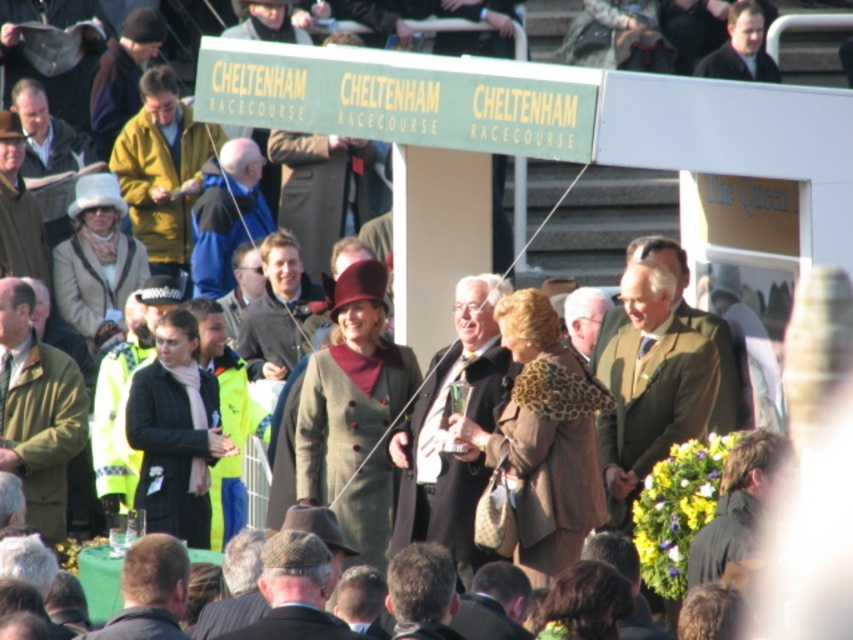
Who is more forward, (688, 429) or (33, 429)?

Point (688, 429)

Based on the photo, which is below, green wool coat at center or green wool coat at left?

green wool coat at left is below.

Which is in front, point (614, 358) or point (55, 465)?

Point (614, 358) is more forward.

Identify the location of green wool coat at center. The height and width of the screenshot is (640, 853). (650, 387).

Does dark brown leather coat at center appear over green wool coat at left?

No.

Who is more forward, (471, 317) or (21, 349)?

Point (471, 317)

Locate an element on the screen. The width and height of the screenshot is (853, 640). dark brown leather coat at center is located at coordinates (445, 426).

Between point (457, 499) and point (415, 618), which one is positioned behind?

Positioned behind is point (457, 499).

From the picture: Can you confirm if dark brown leather coat at center is shorter than dark brown hair at center?

Yes.

Is point (436, 451) farther from viewer compared to point (412, 568)?

Yes, point (436, 451) is farther from viewer.

Image resolution: width=853 pixels, height=640 pixels. Identify the location of dark brown leather coat at center. (445, 426).